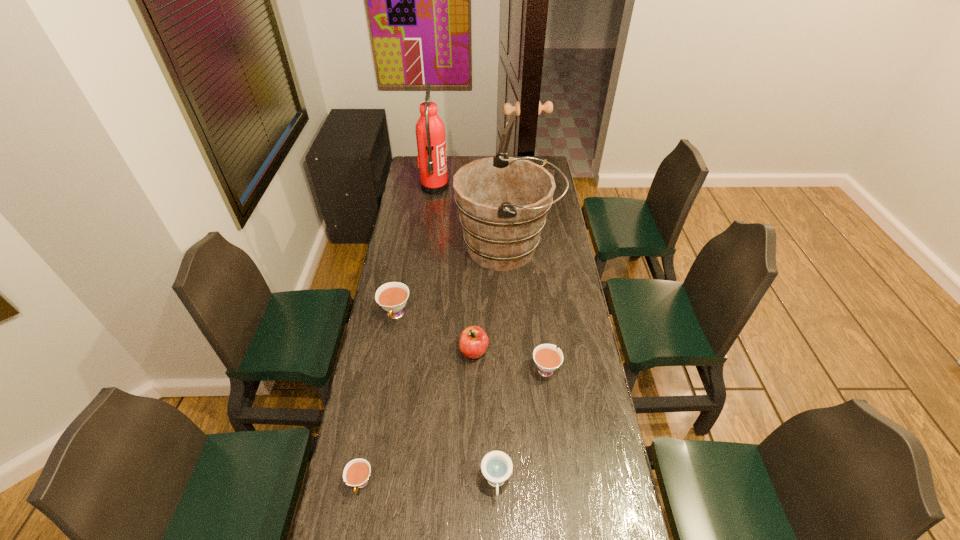
Image resolution: width=960 pixels, height=540 pixels. In order to click on the closest teacup to the second teacup from right to left in this screenshot , I will do coord(547,358).

In order to click on white teacup identified as the closest to the second farthest teacup in this screenshot , I will do `click(392, 297)`.

Identify which white teacup is located as the nearest to the fire extinguisher. Please provide its 2D coordinates. Your answer should be formatted as a tuple, i.e. [(x, y)], where the tuple contains the x and y coordinates of a point satisfying the conditions above.

[(392, 297)]

Image resolution: width=960 pixels, height=540 pixels. I want to click on free spot that satisfies the following two spatial constraints: 1. on the front side of the phonograph record; 2. on the label side of the fire extinguisher, so click(x=523, y=187).

The image size is (960, 540). Identify the location of free region that satisfies the following two spatial constraints: 1. on the handle side of the bucket; 2. on the side of the blue teacup with the handle. (522, 482).

Image resolution: width=960 pixels, height=540 pixels. Find the location of `blank space that satisfies the following two spatial constraints: 1. on the back side of the phonograph record; 2. on the right side of the red apple`. blank space that satisfies the following two spatial constraints: 1. on the back side of the phonograph record; 2. on the right side of the red apple is located at coordinates (476, 185).

This screenshot has height=540, width=960. I want to click on free space that satisfies the following two spatial constraints: 1. on the handle side of the bucket; 2. on the side of the blue teacup with the handle, so click(x=522, y=482).